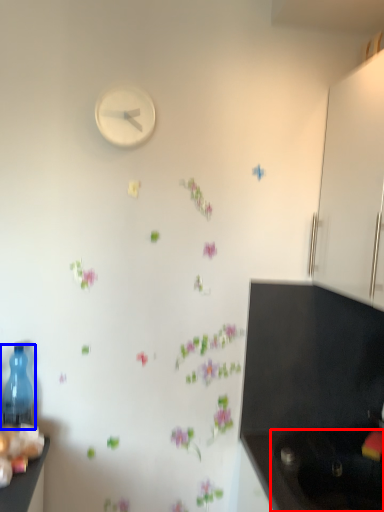
Question: Among these objects, which one is farthest to the camera, sink (highlighted by a red box) or bottle (highlighted by a blue box)?

Choices:
 (A) sink
 (B) bottle

Answer: (B)